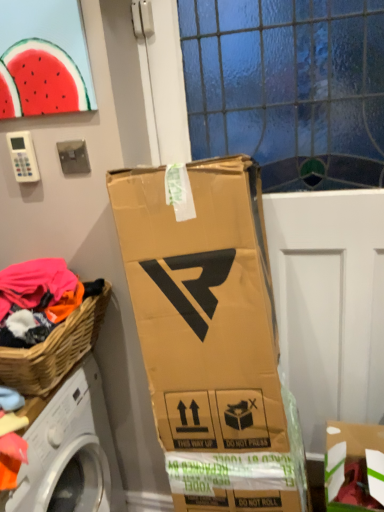
Question: Considering the relative positions of transparent glass door at center and woven wood picnic basket at lower left in the image provided, is transparent glass door at center to the left or to the right of woven wood picnic basket at lower left?

Choices:
 (A) left
 (B) right

Answer: (B)

Question: From a real-world perspective, is transparent glass door at center physically located above or below woven wood picnic basket at lower left?

Choices:
 (A) above
 (B) below

Answer: (B)

Question: Estimate the real-world distances between objects in this image. Which object is closer to the cardboard box at lower right?

Choices:
 (A) transparent glass door at center
 (B) woven wood picnic basket at lower left
 (C) white plastic washing machine at lower left
 (D) watermelon at upper left

Answer: (A)

Question: Estimate the real-world distances between objects in this image. Which object is farther from the cardboard box at lower right?

Choices:
 (A) woven wood picnic basket at lower left
 (B) white plastic washing machine at lower left
 (C) transparent glass door at center
 (D) watermelon at upper left

Answer: (D)